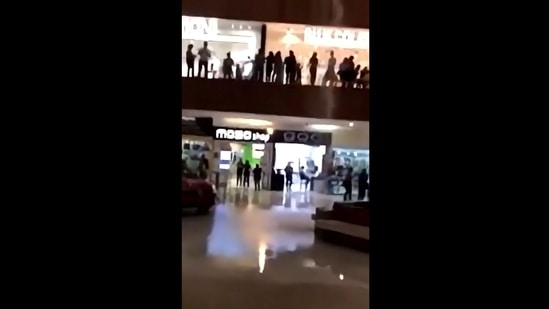
Identify the location of chair. (300, 185).